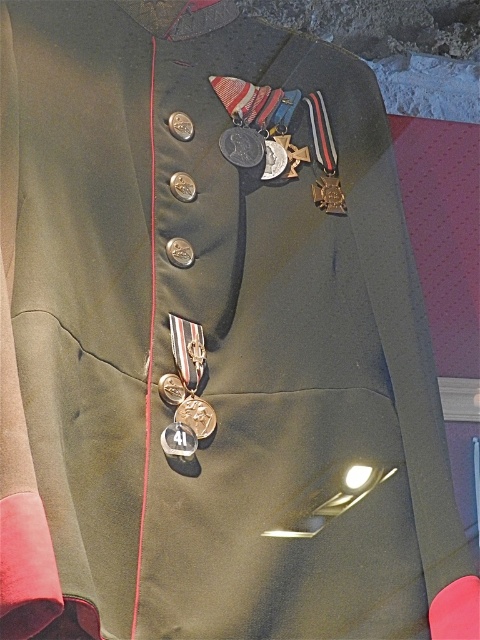
Who is positioned more to the right, gold metallic badge at center or gold metallic cross at center?

gold metallic cross at center is more to the right.

Between point (180, 406) and point (330, 205), which one is positioned in front?

Point (180, 406) is in front.

Locate an element on the screen. The height and width of the screenshot is (640, 480). gold metallic badge at center is located at coordinates (195, 416).